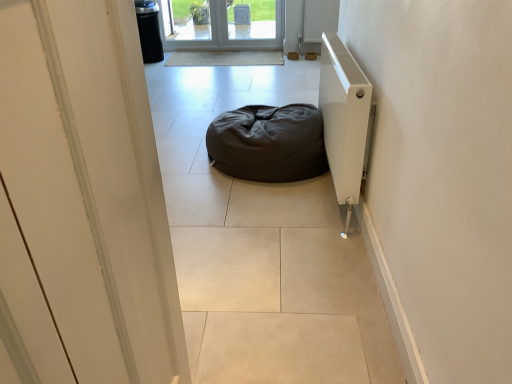
Question: Is white glossy door at upper center not within white textured radiator at right?

Choices:
 (A) no
 (B) yes

Answer: (B)

Question: Considering the relative positions of white glossy door at upper center and white textured radiator at right in the image provided, is white glossy door at upper center in front of white textured radiator at right?

Choices:
 (A) no
 (B) yes

Answer: (B)

Question: From the image's perspective, is white glossy door at upper center on top of white textured radiator at right?

Choices:
 (A) no
 (B) yes

Answer: (A)

Question: Is white glossy door at upper center positioned with its back to white textured radiator at right?

Choices:
 (A) yes
 (B) no

Answer: (B)

Question: Is white glossy door at upper center to the right of white textured radiator at right from the viewer's perspective?

Choices:
 (A) no
 (B) yes

Answer: (A)

Question: Can you confirm if white glossy door at upper center is bigger than white textured radiator at right?

Choices:
 (A) no
 (B) yes

Answer: (A)

Question: Is dark fabric bean bag at center outside of white textured radiator at right?

Choices:
 (A) yes
 (B) no

Answer: (A)

Question: From a real-world perspective, does dark fabric bean bag at center stand above white textured radiator at right?

Choices:
 (A) no
 (B) yes

Answer: (A)

Question: Is dark fabric bean bag at center looking in the opposite direction of white textured radiator at right?

Choices:
 (A) no
 (B) yes

Answer: (B)

Question: Is dark fabric bean bag at center directly adjacent to white textured radiator at right?

Choices:
 (A) no
 (B) yes

Answer: (A)

Question: Is the depth of dark fabric bean bag at center greater than that of white textured radiator at right?

Choices:
 (A) no
 (B) yes

Answer: (B)

Question: Considering the relative positions of dark fabric bean bag at center and white textured radiator at right in the image provided, is dark fabric bean bag at center to the right of white textured radiator at right from the viewer's perspective?

Choices:
 (A) yes
 (B) no

Answer: (B)

Question: Is white glossy door at upper center positioned behind dark fabric bean bag at center?

Choices:
 (A) no
 (B) yes

Answer: (A)